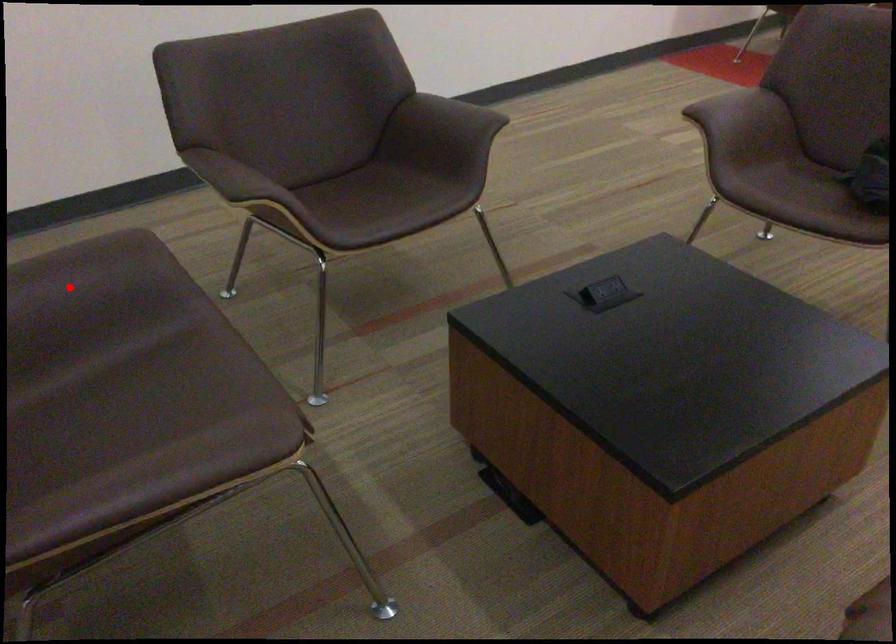
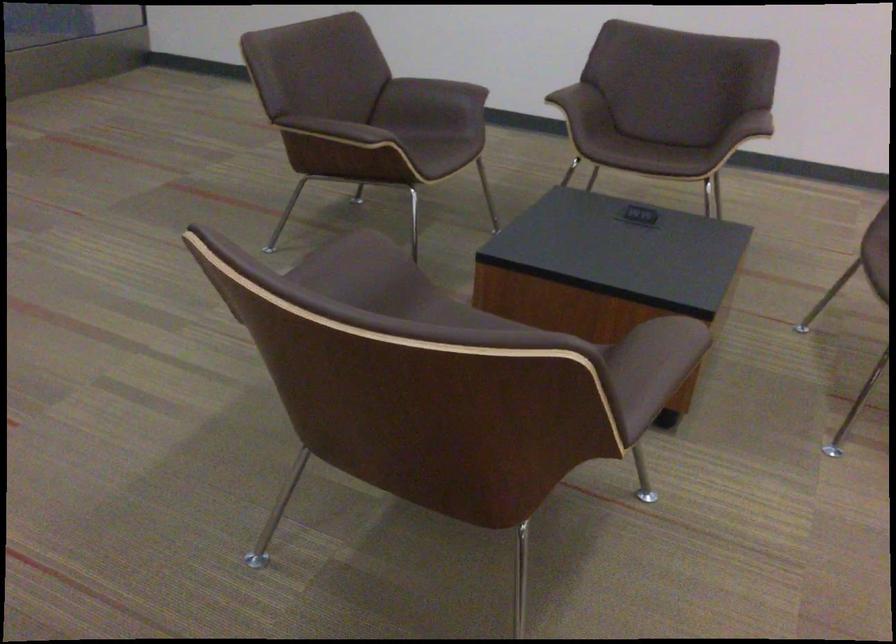
Where in the second image is the point corresponding to the highlighted location from the first image?

(435, 90)